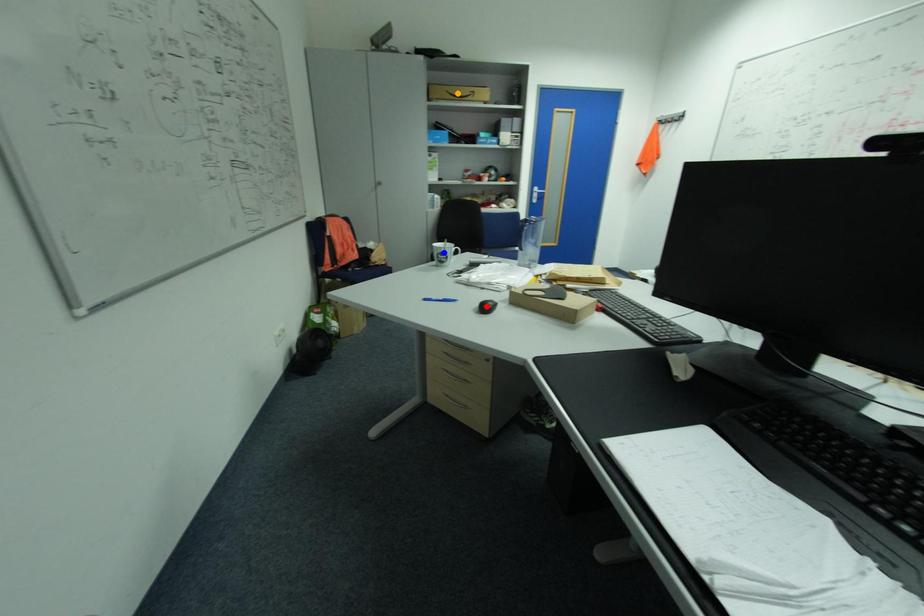
Order these from nearest to farthest:
1. orange point
2. red point
3. blue point

red point, blue point, orange point